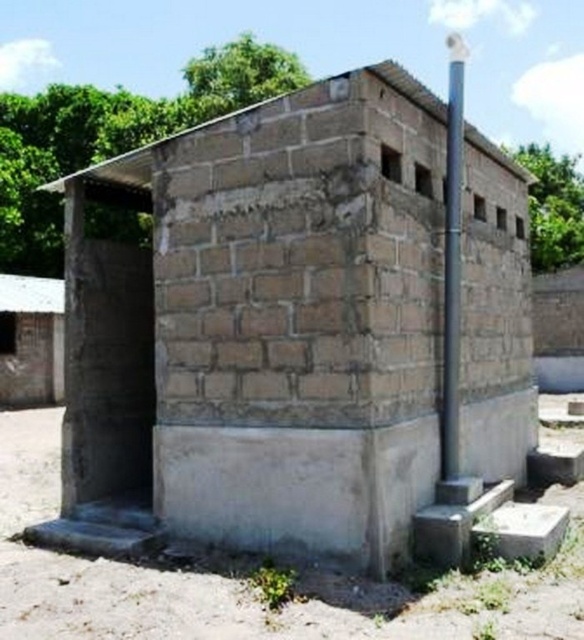
Does brick wall hut at center have a lesser width compared to white corrugated metal hut at left?

Correct, brick wall hut at center's width is less than white corrugated metal hut at left's.

Is brick wall hut at center below white corrugated metal hut at left?

No.

Does point (370, 566) come behind point (1, 328)?

That is False.

Locate an element on the screen. brick wall hut at center is located at coordinates (311, 328).

Which is above, brick wall hut at center or blue metallic pole at upper right?

Positioned higher is blue metallic pole at upper right.

Which is more to the left, brick wall hut at center or blue metallic pole at upper right?

Positioned to the left is brick wall hut at center.

At what (x,y) coordinates should I click in order to perform the action: click on brick wall hut at center. Please return your answer as a coordinate pair (x, y). The height and width of the screenshot is (640, 584). Looking at the image, I should click on (311, 328).

Can you confirm if white corrugated metal hut at left is smaller than blue metallic pole at upper right?

Yes.

Who is more distant from viewer, (4, 317) or (450, 422)?

The point (4, 317) is behind.

Where is `white corrugated metal hut at left`? This screenshot has width=584, height=640. white corrugated metal hut at left is located at coordinates (30, 339).